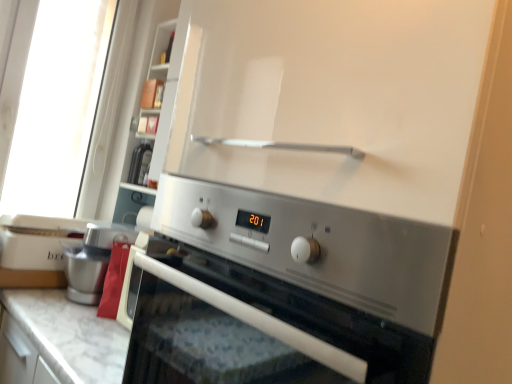
Question: Is white plastic toaster at left in front of satin silver oven at center?

Choices:
 (A) yes
 (B) no

Answer: (B)

Question: Is white plastic toaster at left positioned far away from satin silver oven at center?

Choices:
 (A) yes
 (B) no

Answer: (A)

Question: Considering the relative sizes of white plastic toaster at left and satin silver oven at center in the image provided, is white plastic toaster at left wider than satin silver oven at center?

Choices:
 (A) no
 (B) yes

Answer: (A)

Question: Does white plastic toaster at left have a lesser width compared to satin silver oven at center?

Choices:
 (A) yes
 (B) no

Answer: (A)

Question: Is white plastic toaster at left taller than satin silver oven at center?

Choices:
 (A) yes
 (B) no

Answer: (B)

Question: From their relative heights in the image, would you say white marble countertop at lower center is taller or shorter than satin silver oven at center?

Choices:
 (A) short
 (B) tall

Answer: (A)

Question: Is white marble countertop at lower center in front of or behind satin silver oven at center in the image?

Choices:
 (A) front
 (B) behind

Answer: (B)

Question: Considering the positions of point coord(90,329) and point coord(377,370), is point coord(90,329) closer or farther from the camera than point coord(377,370)?

Choices:
 (A) farther
 (B) closer

Answer: (A)

Question: In the image, is white marble countertop at lower center on the left side or the right side of satin silver oven at center?

Choices:
 (A) left
 (B) right

Answer: (A)

Question: Is white plastic toaster at left taller or shorter than satin silver oven at center?

Choices:
 (A) tall
 (B) short

Answer: (B)

Question: Looking at their shapes, would you say white plastic toaster at left is wider or thinner than satin silver oven at center?

Choices:
 (A) wide
 (B) thin

Answer: (B)

Question: Based on their sizes in the image, would you say white plastic toaster at left is bigger or smaller than satin silver oven at center?

Choices:
 (A) small
 (B) big

Answer: (A)

Question: Is point (1, 256) closer or farther from the camera than point (201, 364)?

Choices:
 (A) closer
 (B) farther

Answer: (B)

Question: Is satin silver oven at center inside the boundaries of white plastic toaster at left, or outside?

Choices:
 (A) inside
 (B) outside

Answer: (B)

Question: Considering the positions of satin silver oven at center and white plastic toaster at left in the image, is satin silver oven at center bigger or smaller than white plastic toaster at left?

Choices:
 (A) big
 (B) small

Answer: (A)